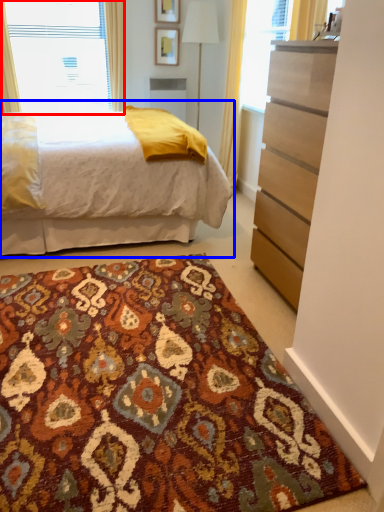
Question: Which of the following is the closest to the observer, window (highlighted by a red box) or bed (highlighted by a blue box)?

Choices:
 (A) window
 (B) bed

Answer: (B)